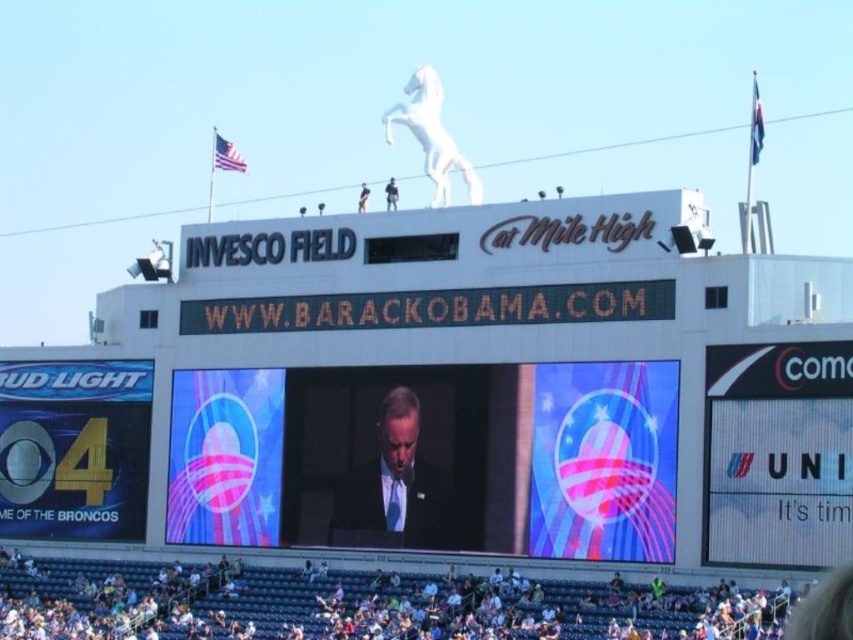
Between shiny digital display at center and white fabric crowd at lower center, which one has less height?

Standing shorter between the two is white fabric crowd at lower center.

This screenshot has height=640, width=853. Describe the element at coordinates (456, 461) in the screenshot. I see `shiny digital display at center` at that location.

Which is in front, point (448, 371) or point (141, 584)?

Point (448, 371) is more forward.

This screenshot has width=853, height=640. In order to click on shiny digital display at center in this screenshot , I will do `click(456, 461)`.

Who is taller, shiny digital display at center or dark suit at center?

shiny digital display at center is taller.

Which is behind, point (519, 404) or point (332, 506)?

Point (332, 506)

Image resolution: width=853 pixels, height=640 pixels. I want to click on shiny digital display at center, so click(x=456, y=461).

Locate an element on the screen. shiny digital display at center is located at coordinates point(456,461).

Between white fabric crowd at lower center and dark suit at center, which one is positioned higher?

Positioned higher is dark suit at center.

Between white fabric crowd at lower center and dark suit at center, which one is positioned lower?

Positioned lower is white fabric crowd at lower center.

Which is in front, point (679, 604) or point (405, 515)?

Positioned in front is point (679, 604).

At what (x,y) coordinates should I click in order to perform the action: click on white fabric crowd at lower center. Please return your answer as a coordinate pair (x, y). Looking at the image, I should click on pos(368,602).